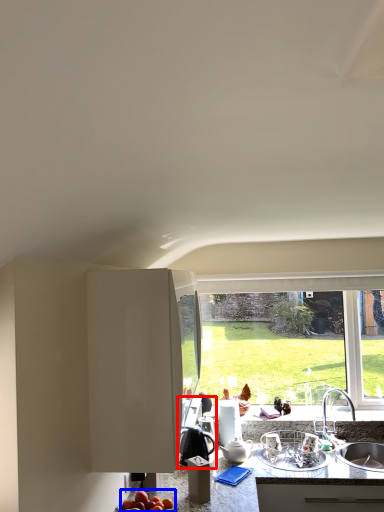
Question: Which of the following is the closest to the observer, appliance (highlighted by a red box) or apple (highlighted by a blue box)?

Choices:
 (A) appliance
 (B) apple

Answer: (B)